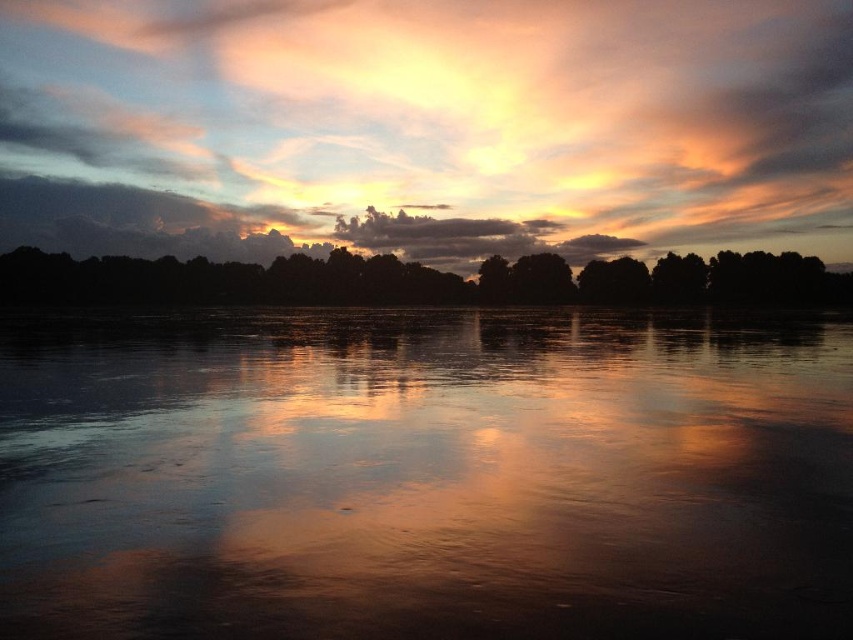
Measure the distance between smooth reflective water at center and silhouette trees at center.

smooth reflective water at center and silhouette trees at center are 168.46 meters apart.

Identify the location of smooth reflective water at center. (425, 476).

Can you confirm if smooth reflective water at center is smaller than cloudy sky at upper center?

Yes.

Between smooth reflective water at center and cloudy sky at upper center, which one is positioned lower?

smooth reflective water at center is below.

Who is more distant from viewer, (16, 502) or (474, 234)?

Point (474, 234)

Identify the location of smooth reflective water at center. This screenshot has width=853, height=640. (425, 476).

How distant is silhouette trees at center from cloudy sky at upper center?

They are 39.73 meters apart.

Is silhouette trees at center further to the viewer compared to cloudy sky at upper center?

No.

Between point (177, 291) and point (379, 224), which one is positioned behind?

Positioned behind is point (379, 224).

Find the location of a particular element. This screenshot has width=853, height=640. silhouette trees at center is located at coordinates (418, 280).